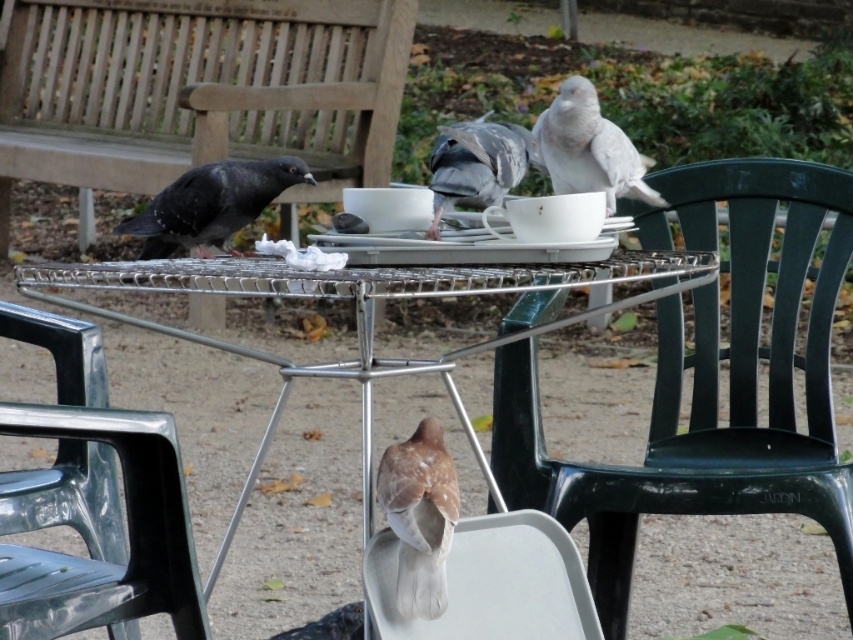
Who is more distant from viewer, (314, 193) or (193, 627)?

The point (314, 193) is more distant.

Who is positioned more to the right, wooden bench at upper left or metallic green chair at lower left?

metallic green chair at lower left is more to the right.

This screenshot has width=853, height=640. Describe the element at coordinates (198, 90) in the screenshot. I see `wooden bench at upper left` at that location.

You are a GUI agent. You are given a task and a screenshot of the screen. Output one action in this format:
    pyautogui.click(x=<x>, y=<y>)
    Task: Click on the wooden bench at upper left
    The image size is (853, 640).
    Given the screenshot: What is the action you would take?
    pyautogui.click(x=198, y=90)

Who is more forward, (135, 465) or (248, 182)?

Point (135, 465)

Can you confirm if metallic green chair at lower left is smaller than dark gray feathers at left?

Incorrect, metallic green chair at lower left is not smaller in size than dark gray feathers at left.

Is point (170, 420) behind point (236, 168)?

No.

This screenshot has width=853, height=640. I want to click on metallic green chair at lower left, so click(106, 481).

Does point (200, 232) come behind point (521, 136)?

That is True.

Between point (198, 218) and point (514, 129), which one is positioned behind?

Point (198, 218)

Is point (285, 180) behind point (477, 186)?

Yes, it is behind point (477, 186).

At what (x,y) coordinates should I click in order to perform the action: click on dark gray feathers at left. Please return your answer as a coordinate pair (x, y). This screenshot has height=640, width=853. Looking at the image, I should click on (212, 204).